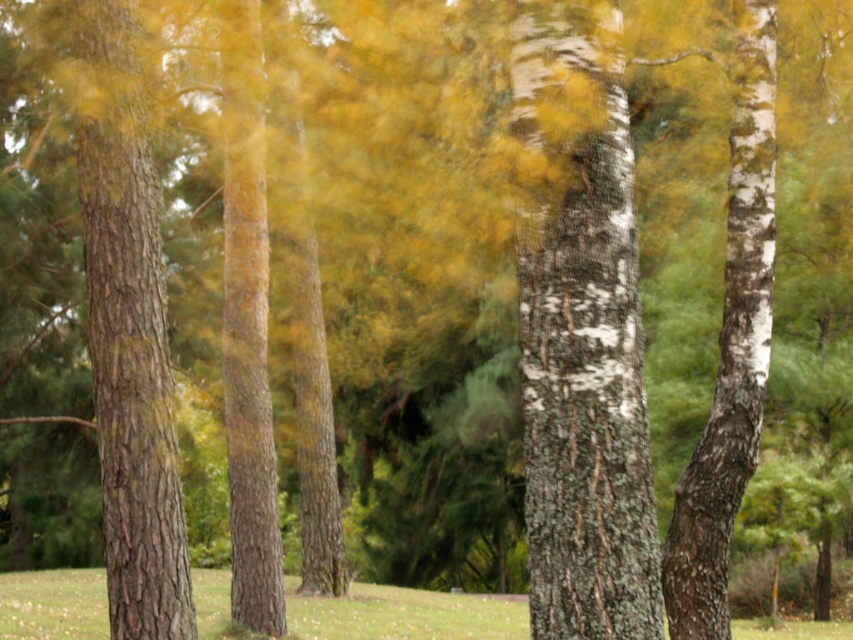
Is point (561, 410) positioned before point (672, 588)?

Yes, it is.

Between point (581, 60) and point (764, 339), which one is positioned in front?

Point (581, 60)

Locate an element on the screen. white bark tree trunk at center is located at coordinates (583, 348).

Can you confirm if brown rough bark tree trunk at left is smaller than white bark tree trunk at right?

No.

Who is higher up, brown rough bark tree trunk at left or white bark tree trunk at right?

brown rough bark tree trunk at left is above.

You are a GUI agent. You are given a task and a screenshot of the screen. Output one action in this format:
    pyautogui.click(x=<x>, y=<y>)
    Task: Click on the brown rough bark tree trunk at left
    
    Given the screenshot: What is the action you would take?
    pyautogui.click(x=128, y=333)

Between point (625, 424) and point (112, 134), which one is positioned in front?

Point (625, 424) is more forward.

Does white bark tree trunk at center have a lesser width compared to brown rough bark tree trunk at left?

Correct, white bark tree trunk at center's width is less than brown rough bark tree trunk at left's.

In the scene shown: Who is more forward, (573, 70) or (129, 444)?

Point (573, 70) is more forward.

This screenshot has height=640, width=853. I want to click on white bark tree trunk at center, so click(583, 348).